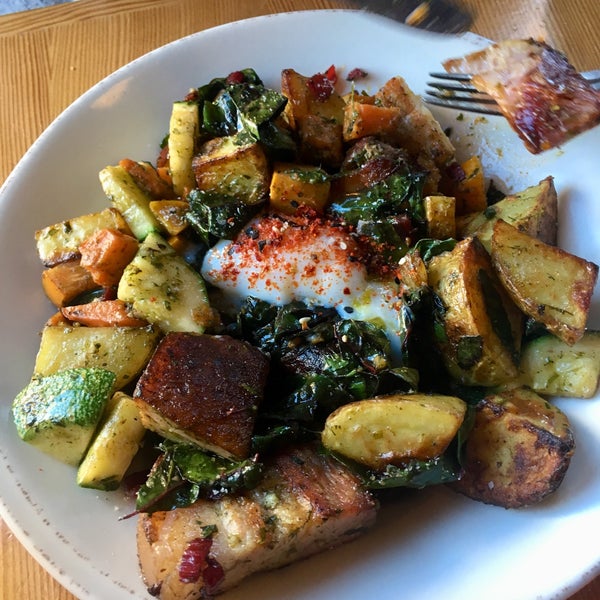
The height and width of the screenshot is (600, 600). In order to click on plate in this screenshot , I will do `click(514, 562)`, `click(232, 39)`.